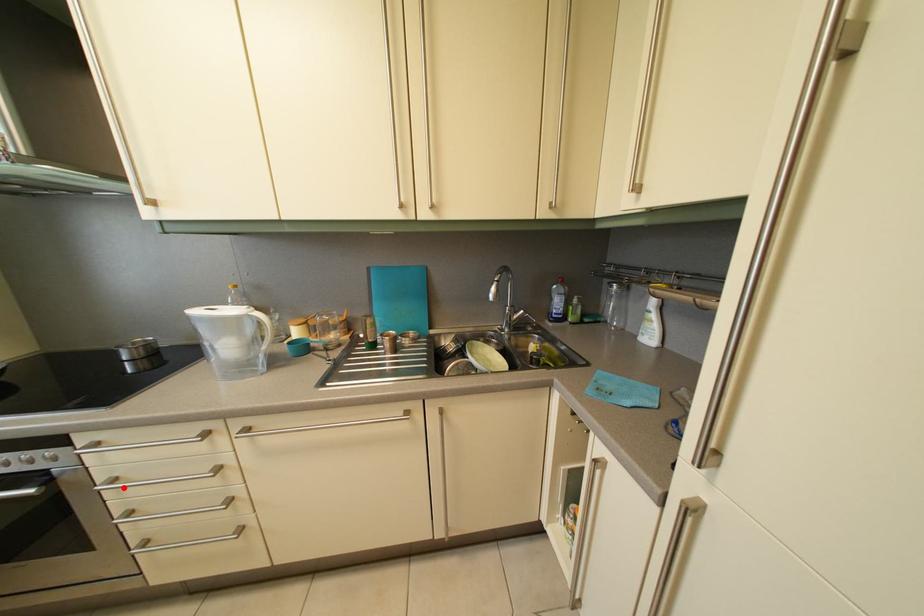
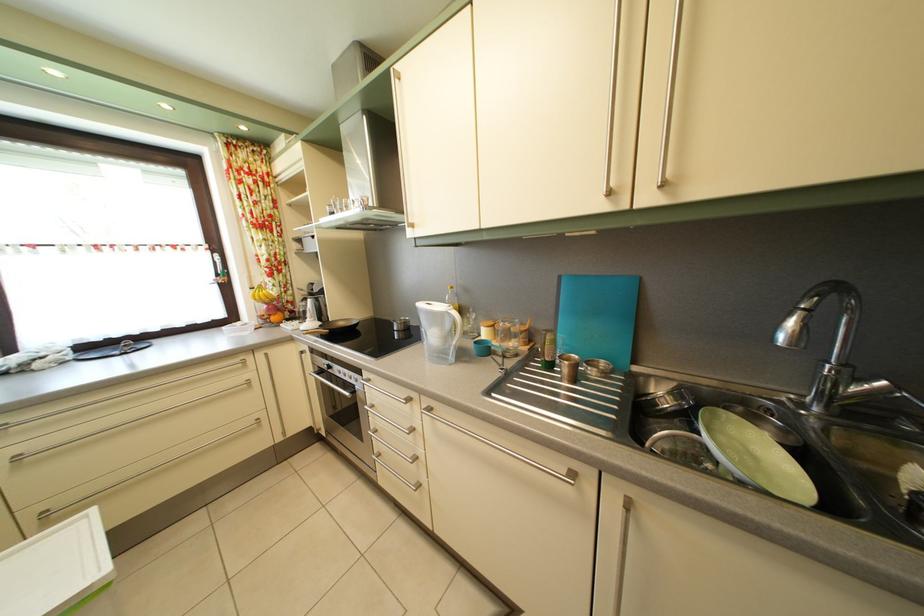
Question: A red point is marked in image1. In image2, is the corresponding 3D point closer to the camera or farther? Reply with the corresponding letter.

Choices:
 (A) The corresponding 3D point is closer.
 (B) The corresponding 3D point is farther.

Answer: (B)